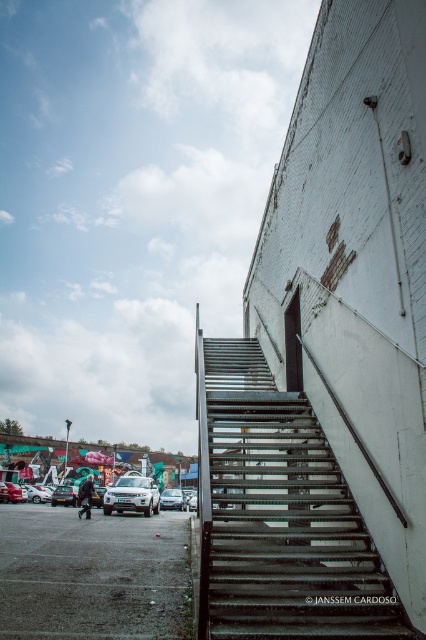
Is metallic gray stairs at center above dark blue leather jacket at lower left?

Indeed, metallic gray stairs at center is positioned over dark blue leather jacket at lower left.

Is metallic gray stairs at center to the right of dark blue leather jacket at lower left from the viewer's perspective?

Indeed, metallic gray stairs at center is positioned on the right side of dark blue leather jacket at lower left.

Locate an element on the screen. metallic gray stairs at center is located at coordinates (279, 515).

Between point (175, 499) and point (80, 513), which one is positioned behind?

The point (175, 499) is behind.

Can you confirm if satin silver sedan at center is wider than dark blue leather jacket at lower left?

No, satin silver sedan at center is not wider than dark blue leather jacket at lower left.

Does point (178, 497) lie behind point (86, 500)?

Yes, it is.

Find the location of `satin silver sedan at center`. satin silver sedan at center is located at coordinates [172, 499].

Is dark asphalt parking lot at lower left smaller than silver metallic suv at lower center?

Correct, dark asphalt parking lot at lower left occupies less space than silver metallic suv at lower center.

Is point (100, 556) positioned before point (98, 493)?

Yes.

At what (x,y) coordinates should I click in order to perform the action: click on dark asphalt parking lot at lower left. Please return your answer as a coordinate pair (x, y). The image size is (426, 640). Looking at the image, I should click on (92, 573).